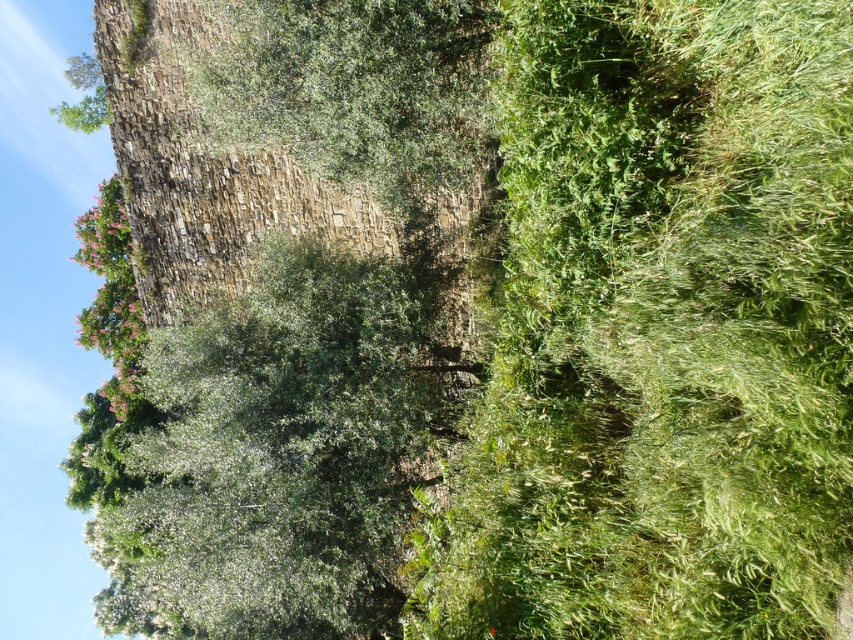
Can you confirm if green leafy tree at center is taller than green leafy tree at upper center?

Correct, green leafy tree at center is much taller as green leafy tree at upper center.

Does green leafy tree at center appear over green leafy tree at upper center?

No.

Where is `green leafy tree at center`? The width and height of the screenshot is (853, 640). green leafy tree at center is located at coordinates (277, 456).

Where is `green leafy tree at center`? This screenshot has height=640, width=853. green leafy tree at center is located at coordinates click(277, 456).

Is point (337, 627) positioned in front of point (107, 355)?

Yes, it is in front of point (107, 355).

Where is `green leafy tree at center`? The width and height of the screenshot is (853, 640). green leafy tree at center is located at coordinates (277, 456).

Who is positioned more to the right, green leafy tree at upper center or pink matte tree at upper left?

green leafy tree at upper center

Measure the distance from green leafy tree at upper center to pink matte tree at upper left.

They are 47.23 feet apart.

What do you see at coordinates (357, 88) in the screenshot? This screenshot has width=853, height=640. I see `green leafy tree at upper center` at bounding box center [357, 88].

This screenshot has width=853, height=640. What are the coordinates of `green leafy tree at upper center` in the screenshot? It's located at (357, 88).